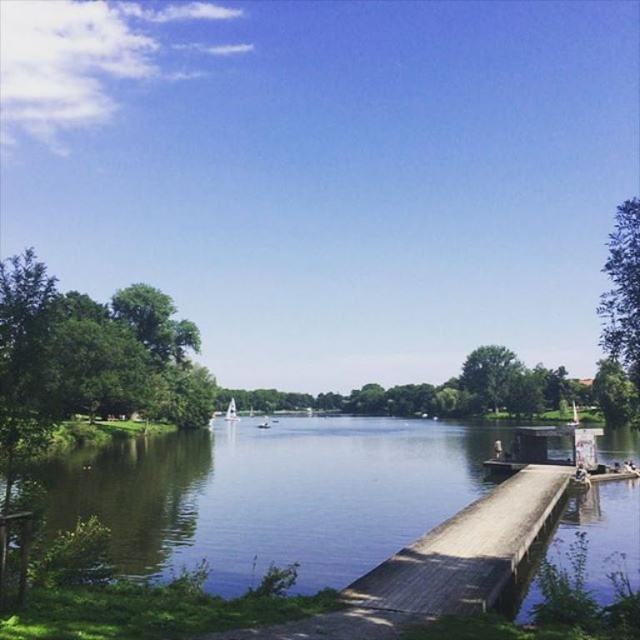
You are planning to dock your wooden dock at lower right to the white glossy sailboat at center. Considering their sizes, which one would you need to adjust in size to make them fit properly?

The wooden dock at lower right has a smaller size compared to white glossy sailboat at center, so you would need to enlarge the wooden dock at lower right to match the size of the white glossy sailboat at center for them to fit properly.

You are standing at the point marked by the coordinates point (x=436, y=566) in the image. What object are you standing on?

You are standing on the wooden dock at lower right.